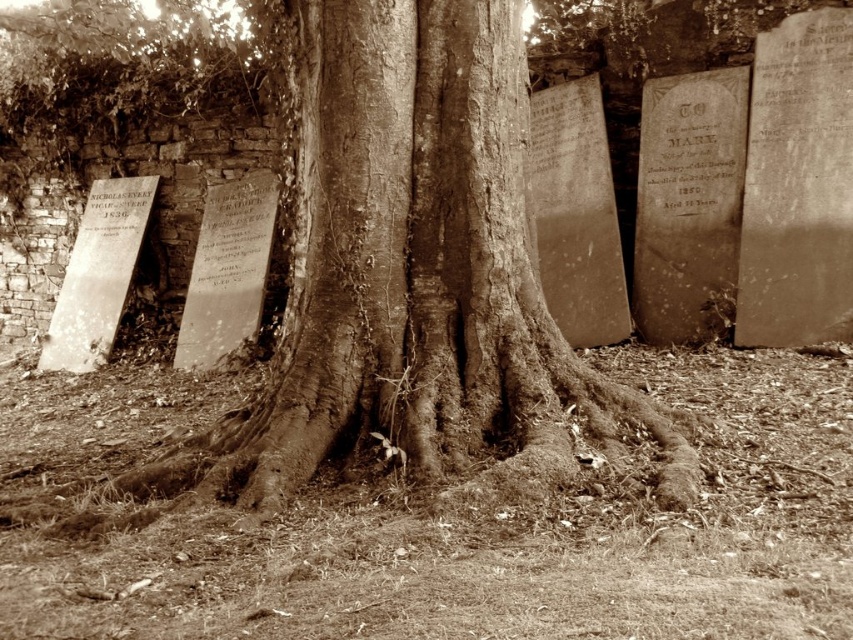
You are a landscape architect planning to place a new bench between the smooth bark tree at center and the smooth stone inscription at center right. To ensure the bench fits, you need to know which object is wider. Which one is wider?

The smooth bark tree at center might be wider than smooth stone inscription at center right, so the bench should be placed near the narrower object to ensure it fits.

You are a gardener planning to place a decorative stone next to the smooth bark tree at center and the smooth stone plaque at center. Which object should you place the stone closer to if you want it to be near the wider one?

The smooth bark tree at center might be wider than the smooth stone plaque at center, so you should place the stone closer to the smooth bark tree at center.

You are a groundskeeper in the cemetery and need to determine which object is shorter between the smooth stone inscription at center right and the smooth stone plaque at center. Which one is shorter?

The smooth stone inscription at center right has a lesser height compared to the smooth stone plaque at center, so the smooth stone inscription at center right is shorter.